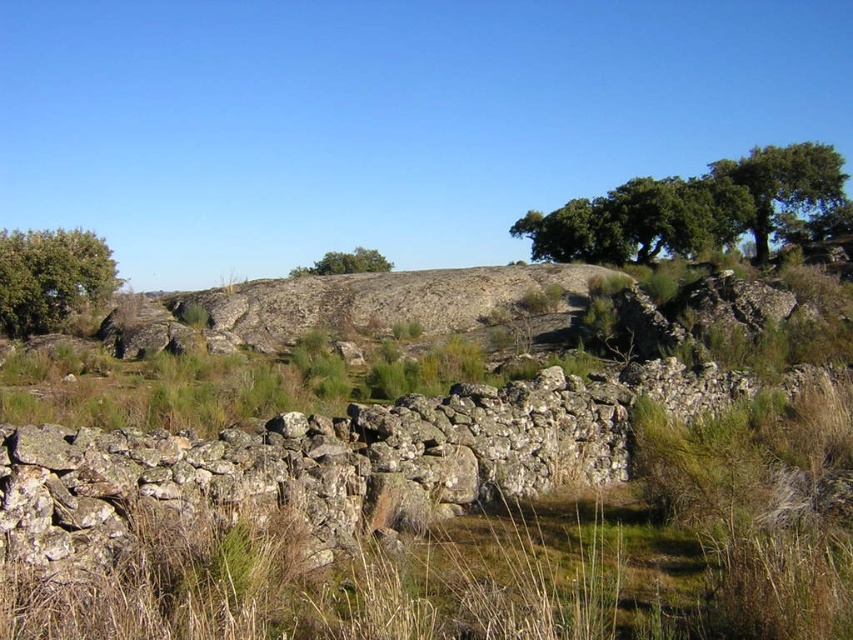
You are standing in front of the weathered stone wall at center and want to reach the green leafy tree at upper right. Which direction should you walk to get there?

The green leafy tree at upper right is positioned above the weathered stone wall at center, so you should walk forward towards the upper part of the scene to reach it.

From the picture: You are standing in front of the weathered stone wall at center and want to reach the green leafy tree at upper right. Which direction should you move to get closer to the tree?

You should move forward away from the weathered stone wall at center because the green leafy tree at upper right is further away from you than the wall. Since the wall is closer, moving forward will bring you closer to the tree.